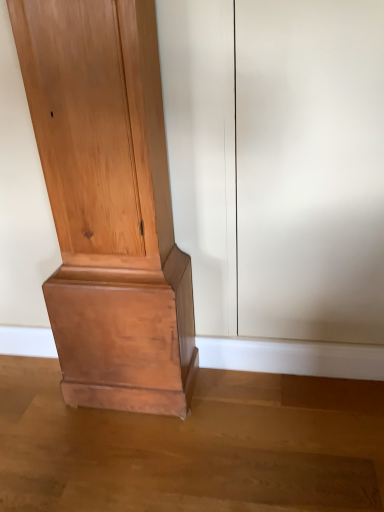
Find the location of a particular element. free location in front of matte wood cabinet at left is located at coordinates (131, 457).